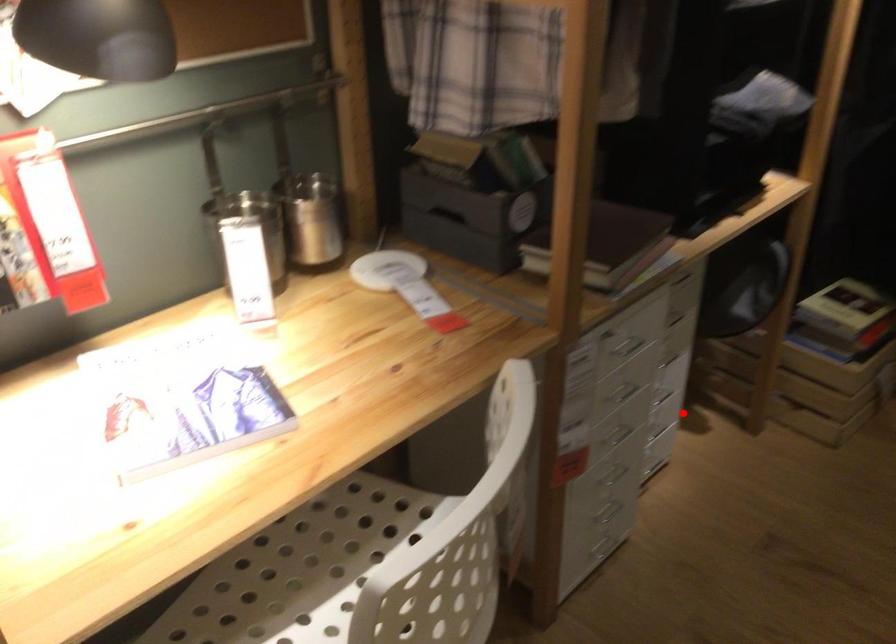
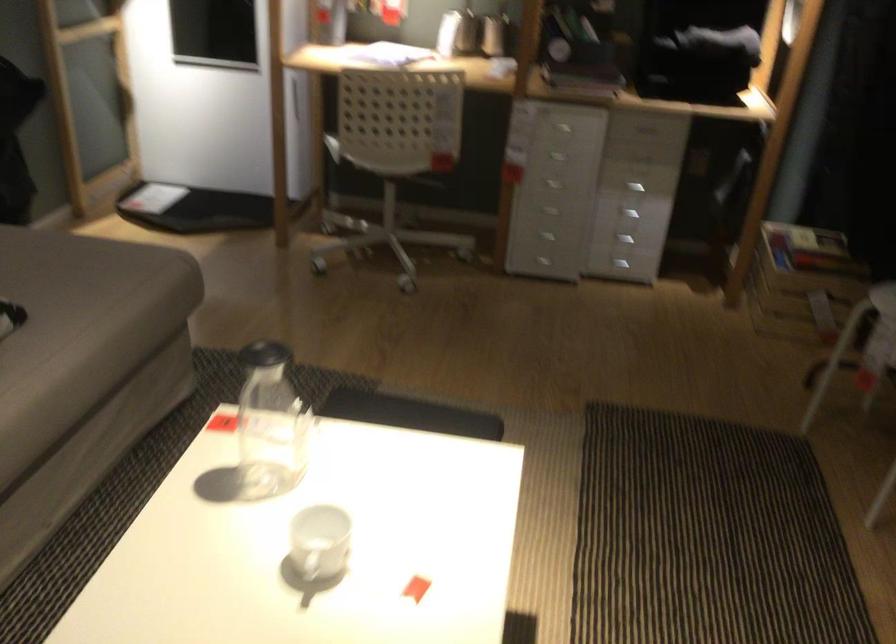
Question: A red point is marked in image1. In image2, is the corresponding 3D point closer to the camera or farther? Reply with the corresponding letter.

Choices:
 (A) The corresponding 3D point is closer.
 (B) The corresponding 3D point is farther.

Answer: (B)